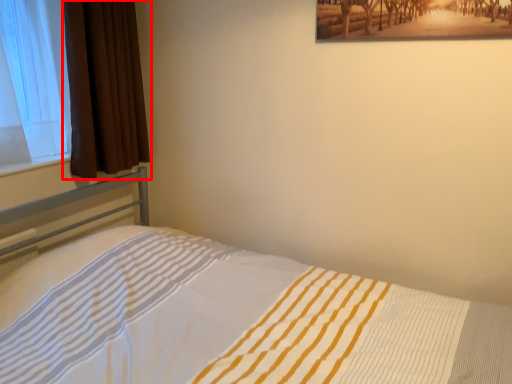
Question: From the image's perspective, considering the relative positions of curtain (annotated by the red box) and bed in the image provided, where is curtain (annotated by the red box) located with respect to the staircase?

Choices:
 (A) below
 (B) above

Answer: (B)